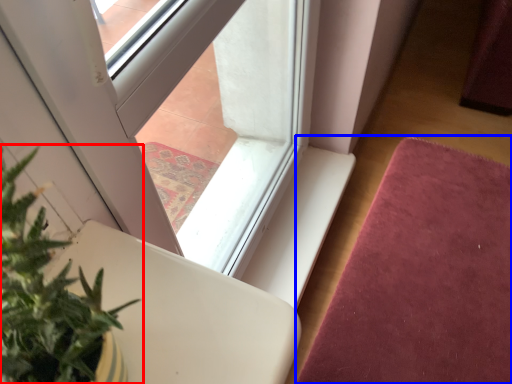
Question: Which object appears farthest to the camera in this image, houseplant (highlighted by a red box) or mat (highlighted by a blue box)?

Choices:
 (A) houseplant
 (B) mat

Answer: (B)